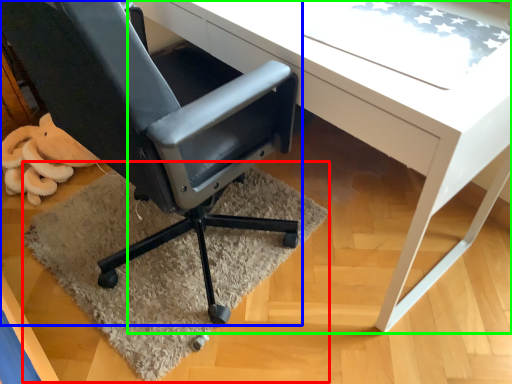
Question: Based on their relative distances, which object is nearer to mat (highlighted by a red box)? Choose from chair (highlighted by a blue box) and desk (highlighted by a green box).

Choices:
 (A) chair
 (B) desk

Answer: (A)